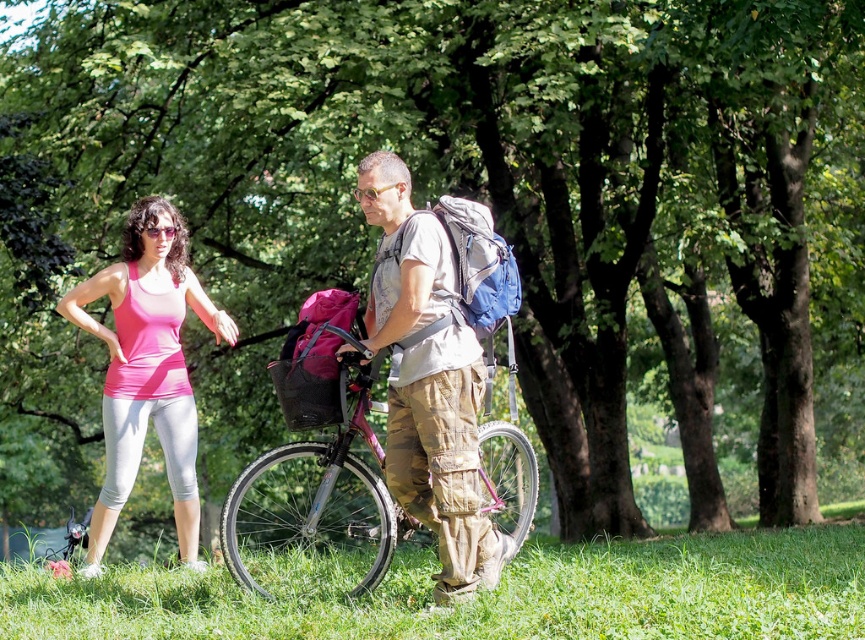
Does green grass at lower center have a smaller size compared to camouflage pants at center?

Yes, green grass at lower center is smaller than camouflage pants at center.

Between green grass at lower center and camouflage pants at center, which one appears on the right side from the viewer's perspective?

camouflage pants at center is more to the right.

Is point (860, 536) farther from camera compared to point (446, 561)?

Yes, point (860, 536) is behind point (446, 561).

Where is `green grass at lower center`? Image resolution: width=865 pixels, height=640 pixels. green grass at lower center is located at coordinates (491, 595).

Is pink matte bicycle at center thinner than pink fabric tank top at left?

Incorrect, pink matte bicycle at center's width is not less than pink fabric tank top at left's.

Can you confirm if pink matte bicycle at center is shorter than pink fabric tank top at left?

No.

This screenshot has width=865, height=640. In order to click on pink matte bicycle at center in this screenshot , I will do `click(316, 509)`.

The height and width of the screenshot is (640, 865). Identify the location of pink matte bicycle at center. (316, 509).

Is point (548, 625) positioned before point (532, 476)?

That is True.

The height and width of the screenshot is (640, 865). What do you see at coordinates (491, 595) in the screenshot? I see `green grass at lower center` at bounding box center [491, 595].

At what (x,y) coordinates should I click in order to perform the action: click on green grass at lower center. Please return your answer as a coordinate pair (x, y). Image resolution: width=865 pixels, height=640 pixels. Looking at the image, I should click on (491, 595).